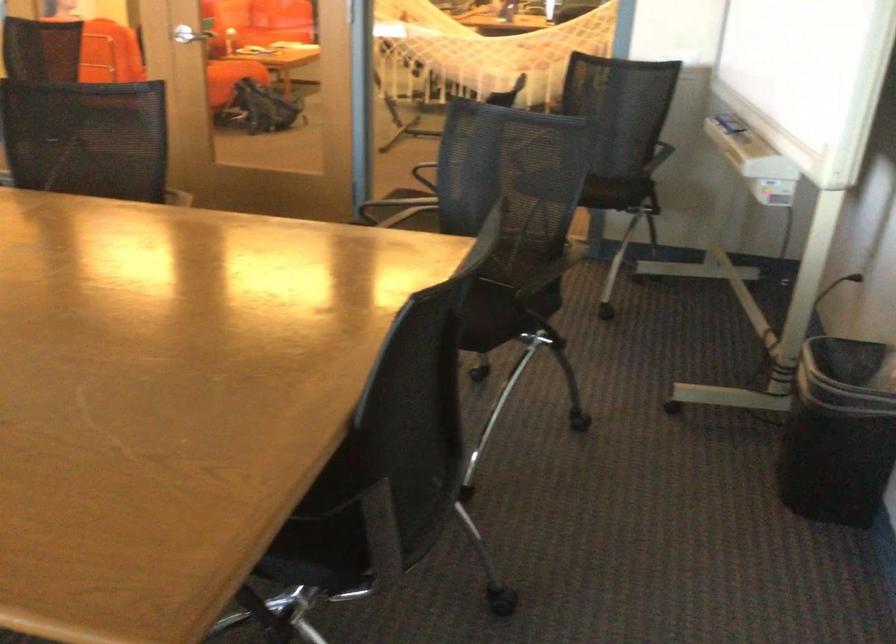
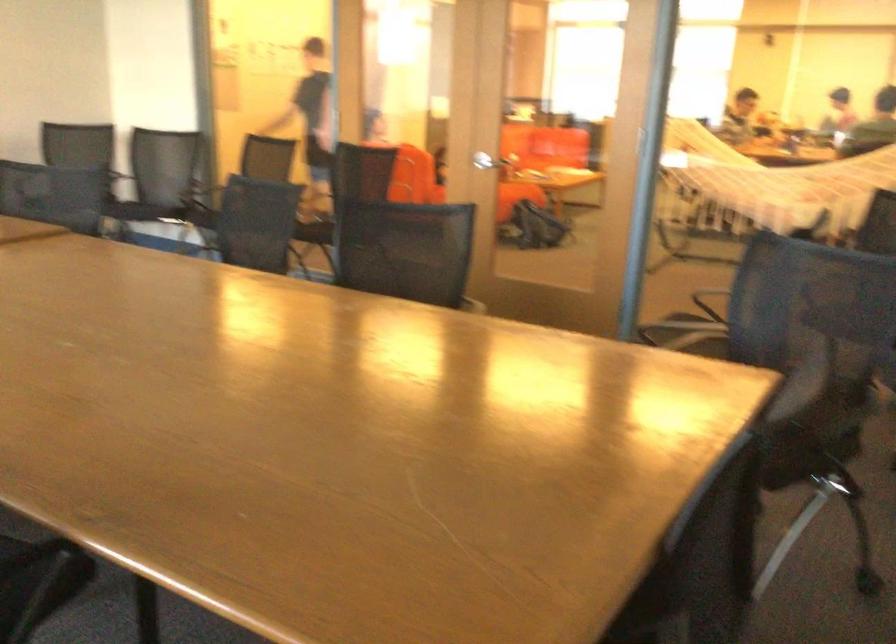
In the second image, find the point that corresponds to (515,310) in the first image.

(803, 453)